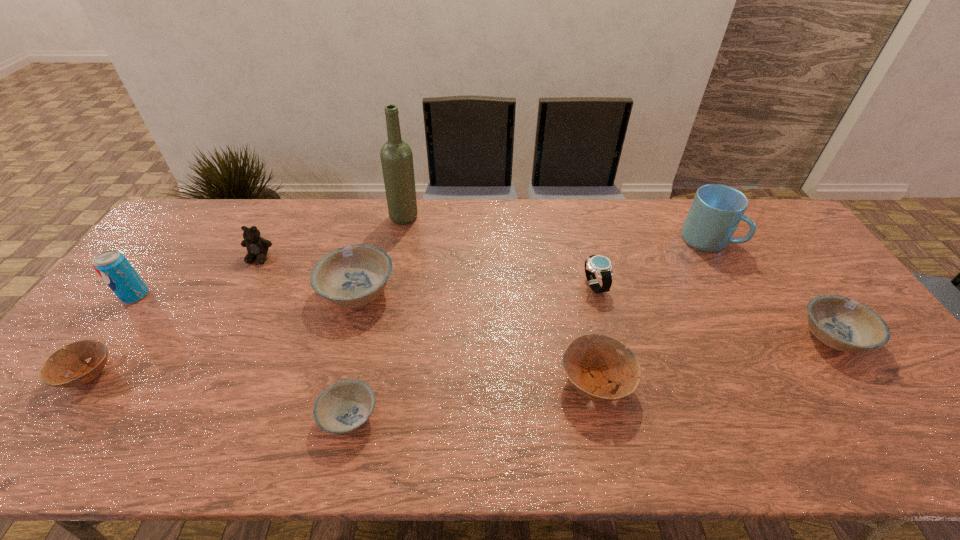
At what (x,y) coordinates should I click in order to perform the action: click on the tallest object. Please return your answer as a coordinate pair (x, y). The image size is (960, 540). Looking at the image, I should click on (396, 155).

Where is `green wine bottle`? Image resolution: width=960 pixels, height=540 pixels. green wine bottle is located at coordinates (396, 155).

Where is `mug`? This screenshot has width=960, height=540. mug is located at coordinates (716, 211).

This screenshot has width=960, height=540. I want to click on soda can, so click(x=113, y=267).

The image size is (960, 540). Find the location of `brown teddy bear`. brown teddy bear is located at coordinates (257, 247).

Locate an element on the screen. the seventh shortest object is located at coordinates (257, 247).

Image resolution: width=960 pixels, height=540 pixels. Find the location of `silver watch`. silver watch is located at coordinates (601, 265).

Find the location of a particular element. the biggest blue bowl is located at coordinates (352, 276).

This screenshot has width=960, height=540. Identify the location of the bigger brown bowl. (590, 362).

The height and width of the screenshot is (540, 960). Find the location of `the right brown bowl`. the right brown bowl is located at coordinates click(590, 362).